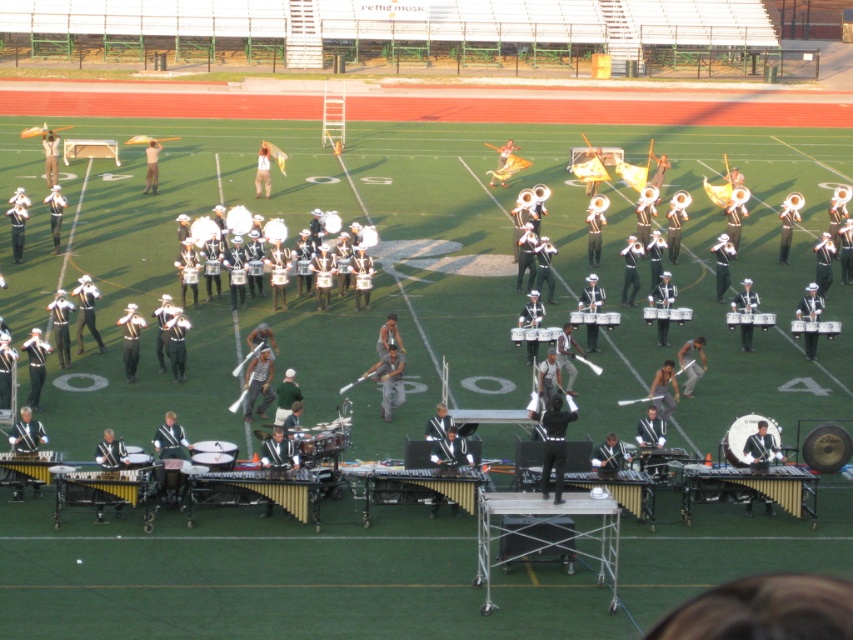
Who is lower down, shiny silver drum at center or metallic silver drum at center?

Positioned lower is metallic silver drum at center.

Based on the photo, between shiny silver drum at center and metallic silver drum at center, which one appears on the right side from the viewer's perspective?

metallic silver drum at center

What do you see at coordinates (750, 320) in the screenshot? This screenshot has width=853, height=640. I see `shiny silver drum at center` at bounding box center [750, 320].

This screenshot has height=640, width=853. Identify the location of shiny silver drum at center. (750, 320).

Looking at this image, between metallic silver drum at center and metallic silver drums at center, which one appears on the right side from the viewer's perspective?

metallic silver drum at center

Is metallic silver drum at center wider than metallic silver drums at center?

Correct, the width of metallic silver drum at center exceeds that of metallic silver drums at center.

Is point (792, 330) in front of point (662, 317)?

Yes, point (792, 330) is in front of point (662, 317).

The image size is (853, 640). I want to click on metallic silver drum at center, so click(815, 326).

Does matte black drum at center have a larger size compared to metallic silver drum at center?

Correct, matte black drum at center is larger in size than metallic silver drum at center.

Is matte black drum at center smaller than metallic silver drum at center?

No, matte black drum at center is not smaller than metallic silver drum at center.

What do you see at coordinates (752, 440) in the screenshot? Image resolution: width=853 pixels, height=640 pixels. I see `matte black drum at center` at bounding box center [752, 440].

What are the coordinates of `matte black drum at center` in the screenshot? It's located at (752, 440).